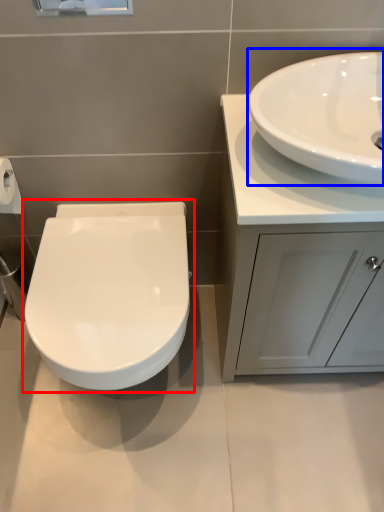
Question: Which object appears closest to the camera in this image, toilet (highlighted by a red box) or sink (highlighted by a blue box)?

Choices:
 (A) toilet
 (B) sink

Answer: (B)